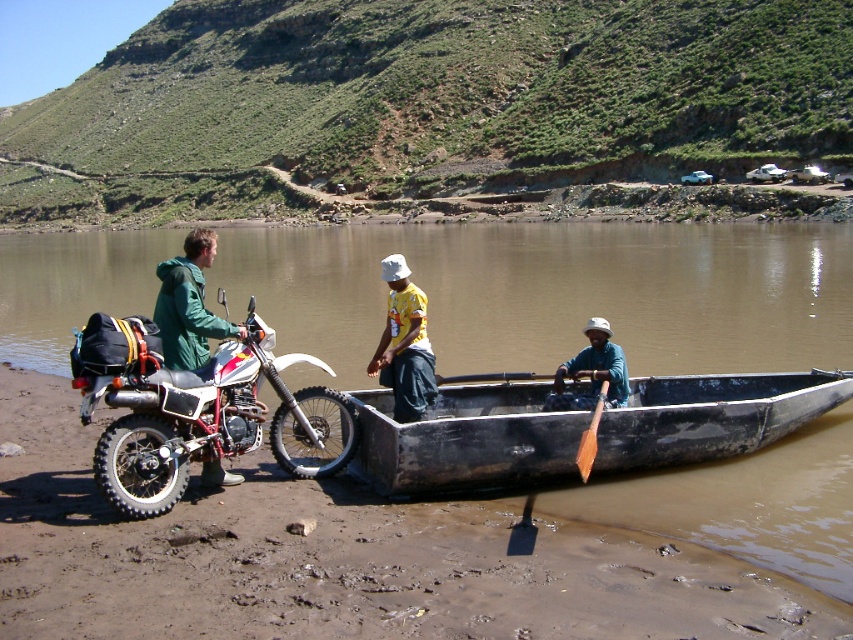
Question: Which point is farther to the camera?

Choices:
 (A) (598, 372)
 (B) (399, 369)
 (C) (366, 410)

Answer: (B)

Question: Considering the relative positions of matte black motorcycle at left and teal fabric hat at center in the image provided, where is matte black motorcycle at left located with respect to teal fabric hat at center?

Choices:
 (A) below
 (B) above

Answer: (B)

Question: Which of the following is the farthest from the observer?

Choices:
 (A) black wooden canoe at lower center
 (B) matte black motorcycle at left
 (C) green matte jacket at left

Answer: (C)

Question: Does black wooden canoe at lower center have a lesser width compared to yellow fabric shirt at center?

Choices:
 (A) yes
 (B) no

Answer: (B)

Question: Which point is closer to the camera taking this photo?

Choices:
 (A) (401, 419)
 (B) (73, 348)
 (C) (602, 323)
 (D) (389, 477)

Answer: (D)

Question: From the image, what is the correct spatial relationship of green matte jacket at left in relation to yellow fabric shirt at center?

Choices:
 (A) below
 (B) above

Answer: (B)